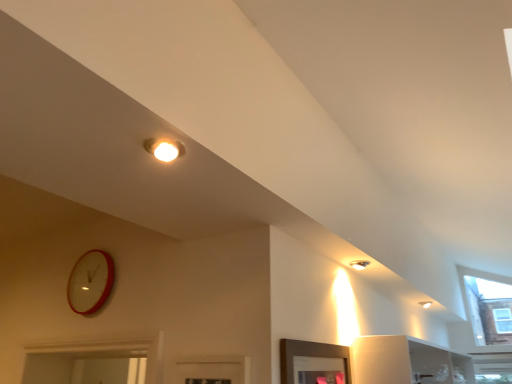
Image resolution: width=512 pixels, height=384 pixels. What do you see at coordinates (90, 282) in the screenshot?
I see `matte red clock at upper left` at bounding box center [90, 282].

Identify the location of matte red clock at upper left. point(90,282).

Locate an element on the screen. The image size is (512, 384). matte red clock at upper left is located at coordinates (90, 282).